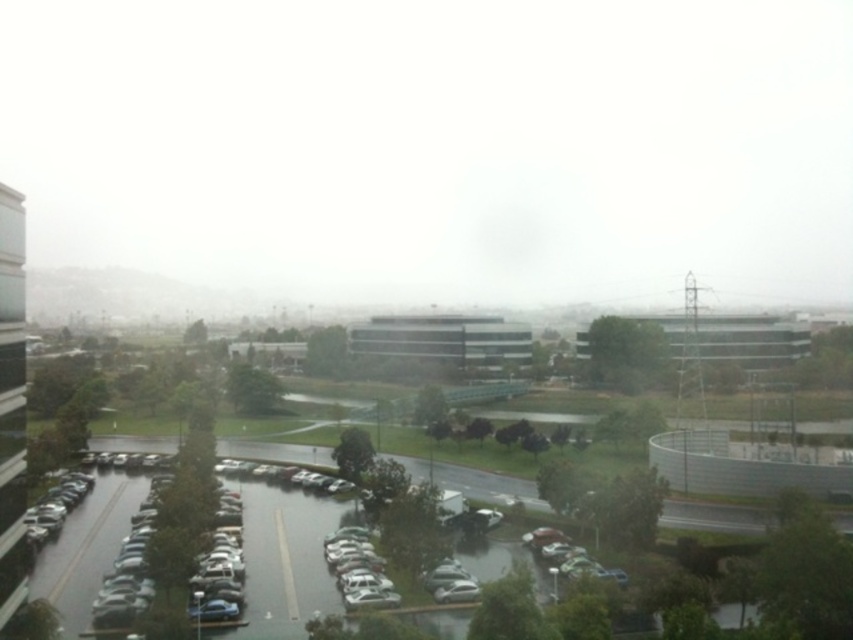
Question: Which object is farther from the camera taking this photo?

Choices:
 (A) white foggy sky at upper center
 (B) glossy asphalt parking lot at lower left

Answer: (A)

Question: Is white foggy sky at upper center to the left of glossy asphalt parking lot at lower left from the viewer's perspective?

Choices:
 (A) no
 (B) yes

Answer: (A)

Question: Can you confirm if white foggy sky at upper center is wider than glossy asphalt parking lot at lower left?

Choices:
 (A) no
 (B) yes

Answer: (B)

Question: Is white foggy sky at upper center below glossy asphalt parking lot at lower left?

Choices:
 (A) yes
 (B) no

Answer: (B)

Question: Which point is farther from the camera taking this photo?

Choices:
 (A) (90, 102)
 (B) (315, 500)

Answer: (A)